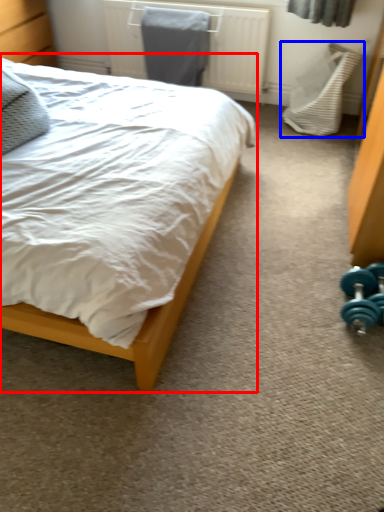
Question: Among these objects, which one is nearest to the camera, bed (highlighted by a red box) or swivel chair (highlighted by a blue box)?

Choices:
 (A) bed
 (B) swivel chair

Answer: (A)